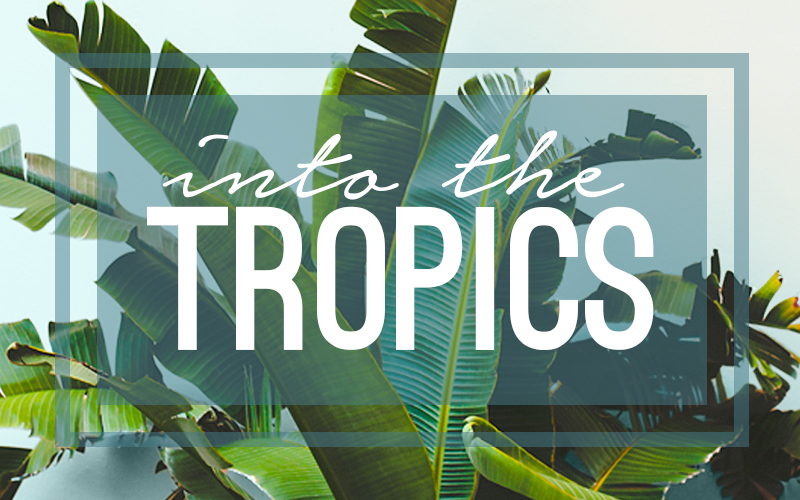
Locate an element on the screen. The image size is (800, 500). edge of flower pot is located at coordinates (10, 471).